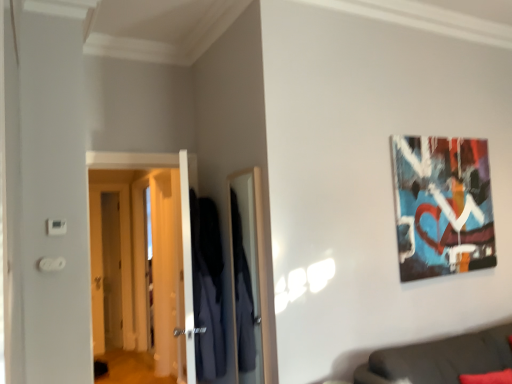
Question: Does abstract painting at upper right have a greater width compared to white glossy door at left, which appears as the 2th door when viewed from the left?

Choices:
 (A) no
 (B) yes

Answer: (A)

Question: Is abstract painting at upper right in contact with white glossy door at left, which appears as the 2th door when viewed from the left?

Choices:
 (A) yes
 (B) no

Answer: (B)

Question: Is abstract painting at upper right turned away from white glossy door at left, which appears as the second door when viewed from the back?

Choices:
 (A) yes
 (B) no

Answer: (B)

Question: Considering the relative sizes of abstract painting at upper right and white glossy door at left, positioned as the 1th door in right-to-left order, in the image provided, is abstract painting at upper right bigger than white glossy door at left, positioned as the 1th door in right-to-left order,?

Choices:
 (A) no
 (B) yes

Answer: (A)

Question: Is abstract painting at upper right to the left of white glossy door at left, which is counted as the 1th door, starting from the front, from the viewer's perspective?

Choices:
 (A) yes
 (B) no

Answer: (B)

Question: Is dark blue fabric robe at center to the left or to the right of abstract painting at upper right in the image?

Choices:
 (A) left
 (B) right

Answer: (A)

Question: From a real-world perspective, relative to abstract painting at upper right, is dark blue fabric robe at center vertically above or below?

Choices:
 (A) below
 (B) above

Answer: (A)

Question: In the image, is dark blue fabric robe at center positioned in front of or behind abstract painting at upper right?

Choices:
 (A) behind
 (B) front

Answer: (B)

Question: Looking at their shapes, would you say dark blue fabric robe at center is wider or thinner than abstract painting at upper right?

Choices:
 (A) wide
 (B) thin

Answer: (A)

Question: From a real-world perspective, is abstract painting at upper right physically located above or below white glossy door at left, positioned as the 1th door in right-to-left order?

Choices:
 (A) above
 (B) below

Answer: (A)

Question: Choose the correct answer: Is abstract painting at upper right inside white glossy door at left, which appears as the second door when viewed from the back, or outside it?

Choices:
 (A) outside
 (B) inside

Answer: (A)

Question: Considering the positions of point (444, 177) and point (185, 258), is point (444, 177) closer or farther from the camera than point (185, 258)?

Choices:
 (A) farther
 (B) closer

Answer: (A)

Question: In the image, is abstract painting at upper right on the left side or the right side of white glossy door at left, positioned as the 1th door in right-to-left order?

Choices:
 (A) left
 (B) right

Answer: (B)

Question: From a real-world perspective, is abstract painting at upper right physically located above or below dark blue fabric robe at center?

Choices:
 (A) above
 (B) below

Answer: (A)

Question: From the image's perspective, is abstract painting at upper right positioned above or below dark blue fabric robe at center?

Choices:
 (A) above
 (B) below

Answer: (A)